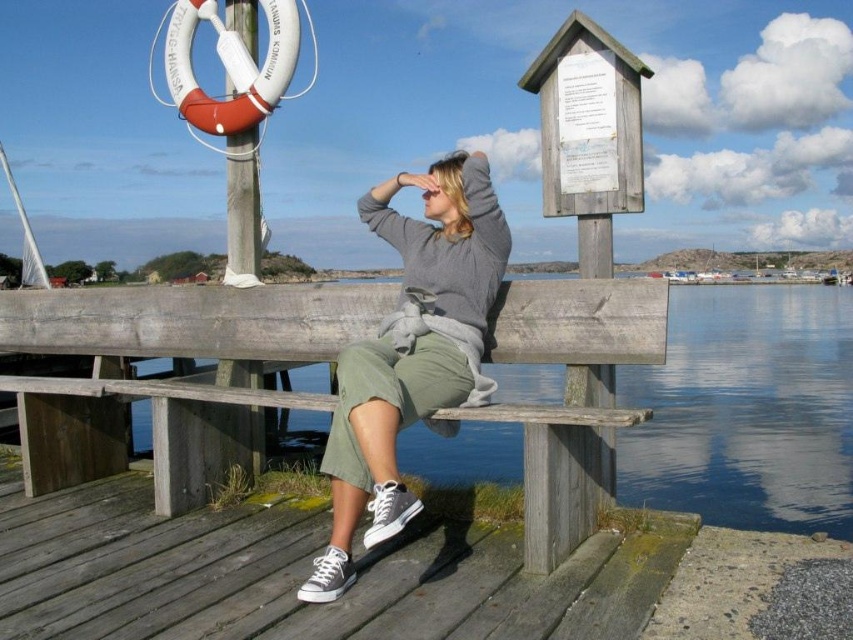
Is point (662, 465) farther from viewer compared to point (381, 390)?

Yes, point (662, 465) is behind point (381, 390).

Can you confirm if transparent blue water at lower center is positioned to the right of gray cotton sweater at center?

Correct, you'll find transparent blue water at lower center to the right of gray cotton sweater at center.

Between point (741, 380) and point (334, 557), which one is positioned behind?

The point (741, 380) is more distant.

Identify the location of transparent blue water at lower center. (746, 410).